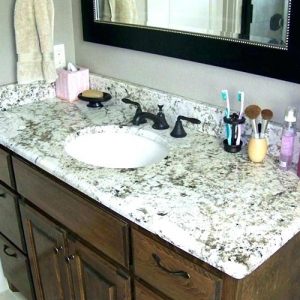
This screenshot has height=300, width=300. I want to click on tissue box, so point(66,84).